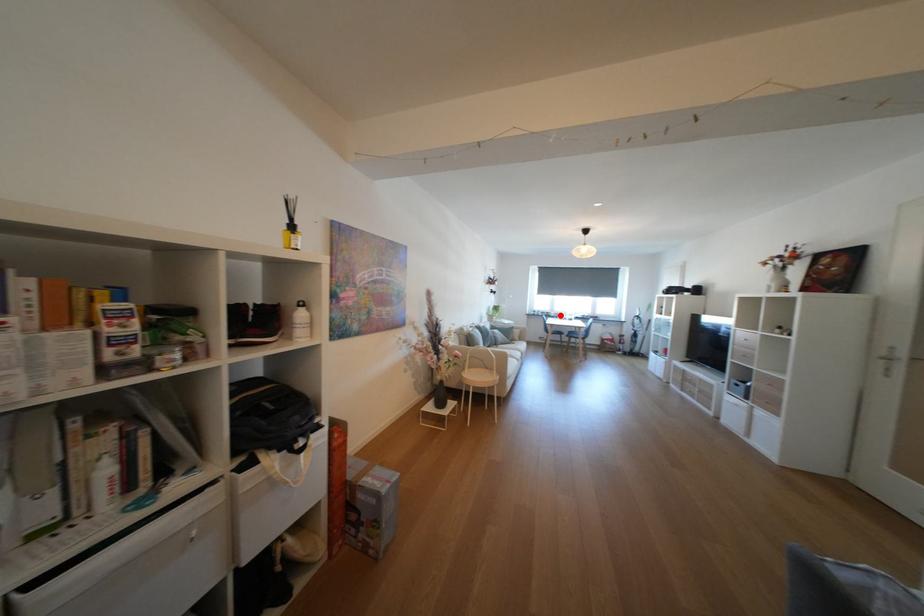
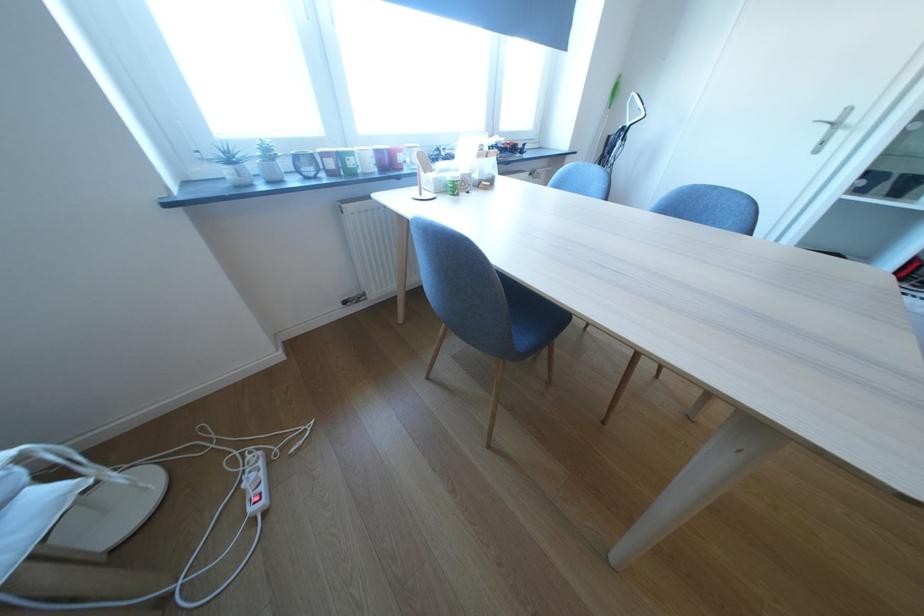
Locate, in the second image, the point that corresponds to the highlighted location in the first image.

(361, 164)